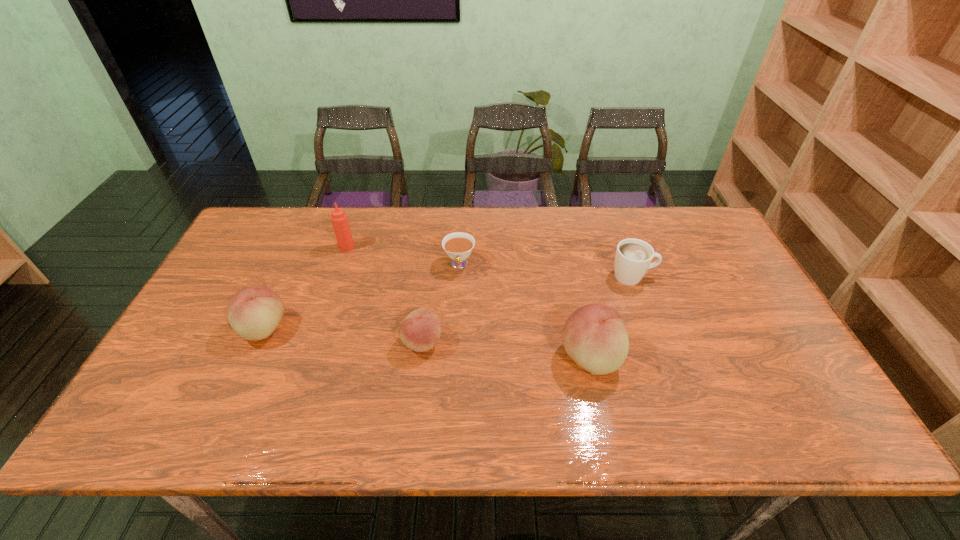
Where is `free space located 0.250m on the right of the shortest peach`? free space located 0.250m on the right of the shortest peach is located at coordinates 540,342.

What are the coordinates of `free space located on the right of the fifth shortest object` in the screenshot? It's located at (732, 357).

Where is `vacant space situated on the right of the Tabasco sauce`? The image size is (960, 540). vacant space situated on the right of the Tabasco sauce is located at coordinates (396, 247).

This screenshot has height=540, width=960. I want to click on vacant space located with the handle on the side of the rightmost object, so click(x=679, y=276).

What are the coordinates of `free point located on the side of the teacup with the handle` in the screenshot? It's located at (454, 362).

I want to click on object located in the far edge section of the desktop, so click(x=339, y=218).

Where is `object that is at the near edge`? This screenshot has width=960, height=540. object that is at the near edge is located at coordinates (594, 336).

The image size is (960, 540). What are the coordinates of `object present at the left edge` in the screenshot? It's located at (254, 313).

Identify the location of free space at the far edge of the desktop. (407, 245).

In order to click on vacant space at the near edge of the desktop in this screenshot , I will do `click(701, 376)`.